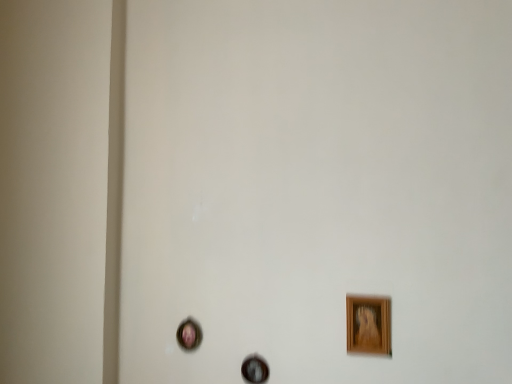
Question: In terms of width, does wooden picture frame at center, the 2th picture frame from the front, look wider or thinner when compared to wooden picture frame at lower right, the third picture frame in the back-to-front sequence?

Choices:
 (A) wide
 (B) thin

Answer: (B)

Question: From the image's perspective, relative to wooden picture frame at lower right, the third picture frame in the back-to-front sequence, is wooden picture frame at center, which is the 2th picture frame in back-to-front order, above or below?

Choices:
 (A) above
 (B) below

Answer: (B)

Question: Which of these objects is positioned farthest from the wooden picture frame at lower right, positioned as the 3th picture frame in left-to-right order?

Choices:
 (A) wooden picture frame at center, which is the 2th picture frame in back-to-front order
 (B) matte pink picture frame at lower left, which is counted as the first picture frame, starting from the back

Answer: (B)

Question: Estimate the real-world distances between objects in this image. Which object is farther from the wooden picture frame at center, the 2th picture frame from the front?

Choices:
 (A) wooden picture frame at lower right, positioned as the 3th picture frame in left-to-right order
 (B) matte pink picture frame at lower left, the first picture frame when ordered from left to right

Answer: (A)